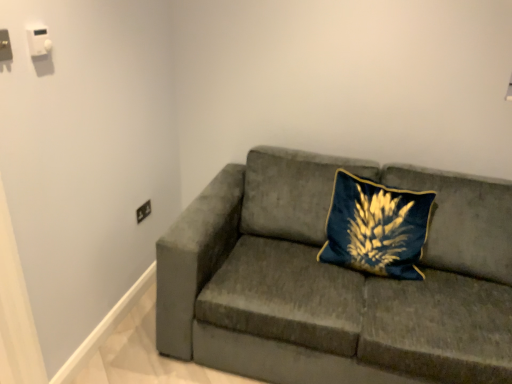
Question: Does white plastic switch at upper left, which ranks as the 2th electric outlet in left-to-right order, lie behind black plastic electrical outlet at lower left, which ranks as the 3th electric outlet in front-to-back order?

Choices:
 (A) yes
 (B) no

Answer: (B)

Question: Is white plastic switch at upper left, acting as the second electric outlet starting from the back, positioned far away from black plastic electrical outlet at lower left, arranged as the 3th electric outlet when viewed from the left?

Choices:
 (A) no
 (B) yes

Answer: (B)

Question: From a real-world perspective, does white plastic switch at upper left, marked as the 3th electric outlet in a bottom-to-top arrangement, stand above black plastic electrical outlet at lower left, the first electric outlet viewed from the back?

Choices:
 (A) yes
 (B) no

Answer: (A)

Question: Is black plastic electrical outlet at lower left, which is the 1th electric outlet from right to left, surrounded by white plastic switch at upper left, marked as the second electric outlet in a front-to-back arrangement?

Choices:
 (A) yes
 (B) no

Answer: (B)

Question: Is black plastic electrical outlet at lower left, the first electric outlet viewed from the back, at the back of white plastic switch at upper left, which is the second electric outlet from right to left?

Choices:
 (A) yes
 (B) no

Answer: (B)

Question: Does white plastic switch at upper left, which ranks as the 2th electric outlet in left-to-right order, have a smaller size compared to black plastic electrical outlet at lower left, marked as the third electric outlet in a top-to-bottom arrangement?

Choices:
 (A) no
 (B) yes

Answer: (B)

Question: Is white plastic switch at upper left, which ranks as the 2th electric outlet in left-to-right order, beside velvet blue pillow at center?

Choices:
 (A) no
 (B) yes

Answer: (A)

Question: From a real-world perspective, is white plastic switch at upper left, which is the second electric outlet from right to left, on top of velvet blue pillow at center?

Choices:
 (A) no
 (B) yes

Answer: (B)

Question: Is white plastic switch at upper left, marked as the second electric outlet in a front-to-back arrangement, not within velvet blue pillow at center?

Choices:
 (A) yes
 (B) no

Answer: (A)

Question: From a real-world perspective, is white plastic switch at upper left, acting as the second electric outlet starting from the back, under velvet blue pillow at center?

Choices:
 (A) no
 (B) yes

Answer: (A)

Question: Can you confirm if white plastic switch at upper left, which is the second electric outlet from right to left, is positioned to the right of velvet blue pillow at center?

Choices:
 (A) no
 (B) yes

Answer: (A)

Question: Considering the relative sizes of white plastic switch at upper left, marked as the 3th electric outlet in a bottom-to-top arrangement, and velvet blue pillow at center in the image provided, is white plastic switch at upper left, marked as the 3th electric outlet in a bottom-to-top arrangement, bigger than velvet blue pillow at center?

Choices:
 (A) yes
 (B) no

Answer: (B)

Question: Considering the relative sizes of velvet gray couch at center and black plastic electrical outlet at lower left, marked as the third electric outlet in a top-to-bottom arrangement, in the image provided, is velvet gray couch at center thinner than black plastic electrical outlet at lower left, marked as the third electric outlet in a top-to-bottom arrangement,?

Choices:
 (A) no
 (B) yes

Answer: (A)